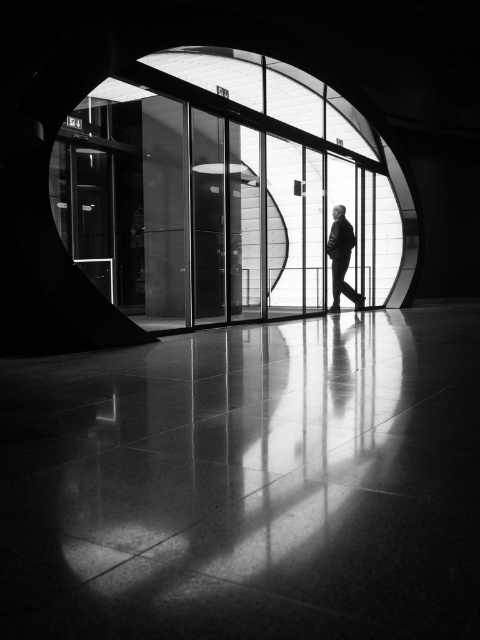
You are a delivery person carrying a large box that is as wide as the silhouette suit at center. You need to enter through the transparent glass door at center. Will the box fit through the door?

The transparent glass door at center is narrower than the silhouette suit at center, so the box, which is as wide as the silhouette suit at center, will not fit through the door.

You are a security guard at the entrance. You notice the silhouette suit at center approaching the transparent glass door at center. Based on their positions, can the person see the door clearly from their current position?

The transparent glass door at center is above the silhouette suit at center, so the person is positioned below the door. Since the door is transparent and the person is facing it, they can see the door clearly from their current position.

You are standing at the entrance of the building shown in the image. The transparent glass door at center is located at point (222, 192). If you want to enter the building, which direction should you walk relative to your current position?

Since the transparent glass door at center is located at point (222, 192), you should walk towards the center of the image to reach the entrance and enter the building.